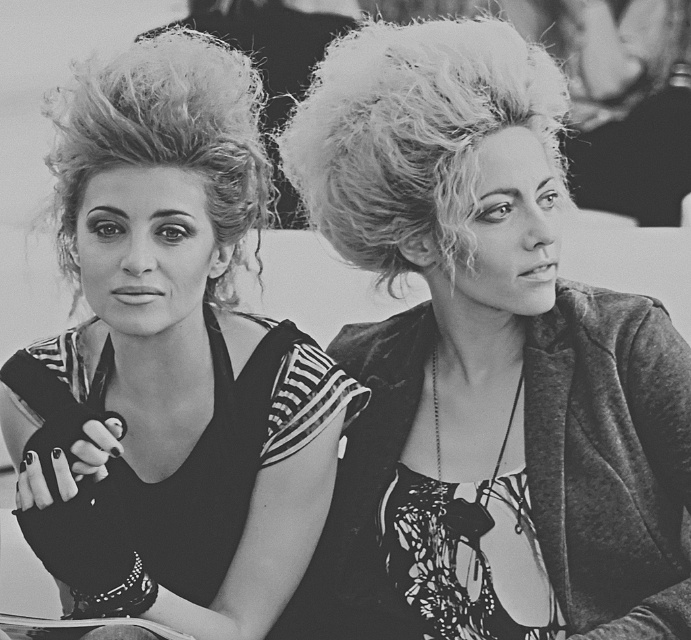
Is fluffy hair at center smaller than matte black dress at center?

Yes.

Consider the image. Does fluffy hair at center have a greater height compared to matte black dress at center?

No.

Who is more distant from viewer, (392, 243) or (106, 608)?

The point (392, 243) is more distant.

Locate an element on the screen. This screenshot has height=640, width=691. fluffy hair at center is located at coordinates (484, 360).